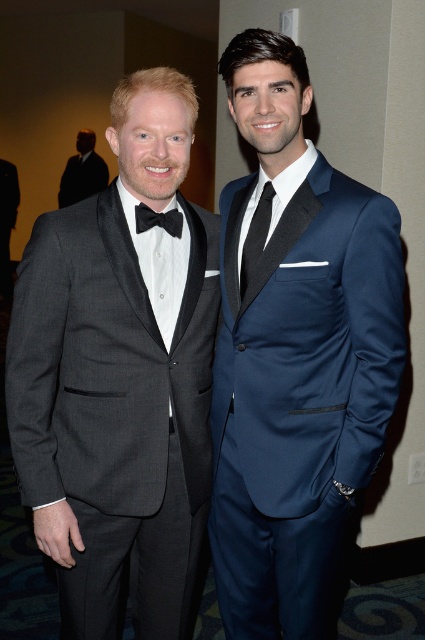
Question: Which point is farther to the camera?

Choices:
 (A) black satin tie at center
 (B) matte black tuxedo at left
 (C) matte black suit at left

Answer: (C)

Question: Does navy blue suit at center have a larger size compared to black satin tie at center?

Choices:
 (A) no
 (B) yes

Answer: (B)

Question: From the image, what is the correct spatial relationship of matte black tuxedo at left in relation to navy blue suit at center?

Choices:
 (A) right
 (B) left

Answer: (B)

Question: Does navy blue suit at center appear over black satin bow tie at left?

Choices:
 (A) no
 (B) yes

Answer: (A)

Question: Among these points, which one is farthest from the camera?

Choices:
 (A) (252, 262)
 (B) (170, 209)
 (C) (81, 172)

Answer: (C)

Question: Which object appears closest to the camera in this image?

Choices:
 (A) matte black suit at left
 (B) navy blue suit at center

Answer: (B)